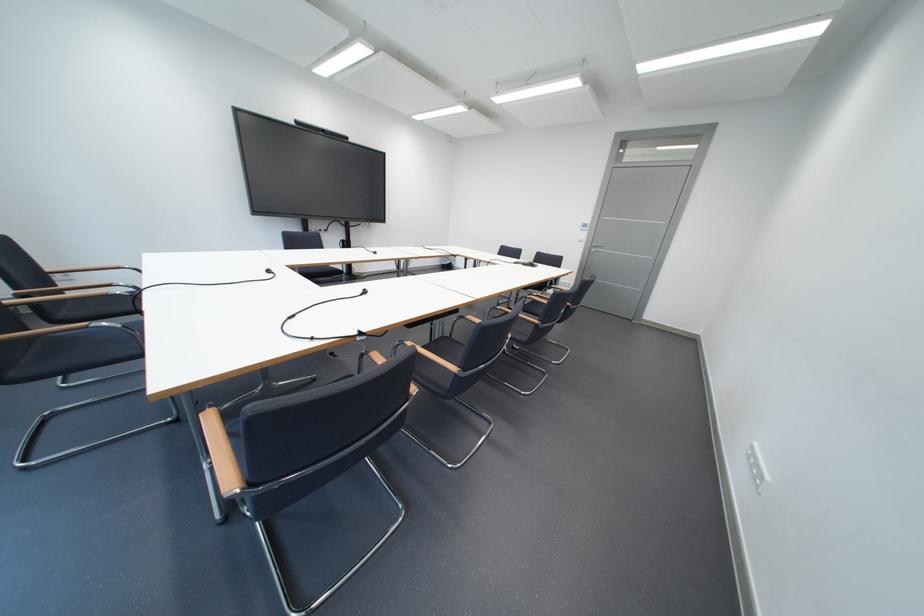
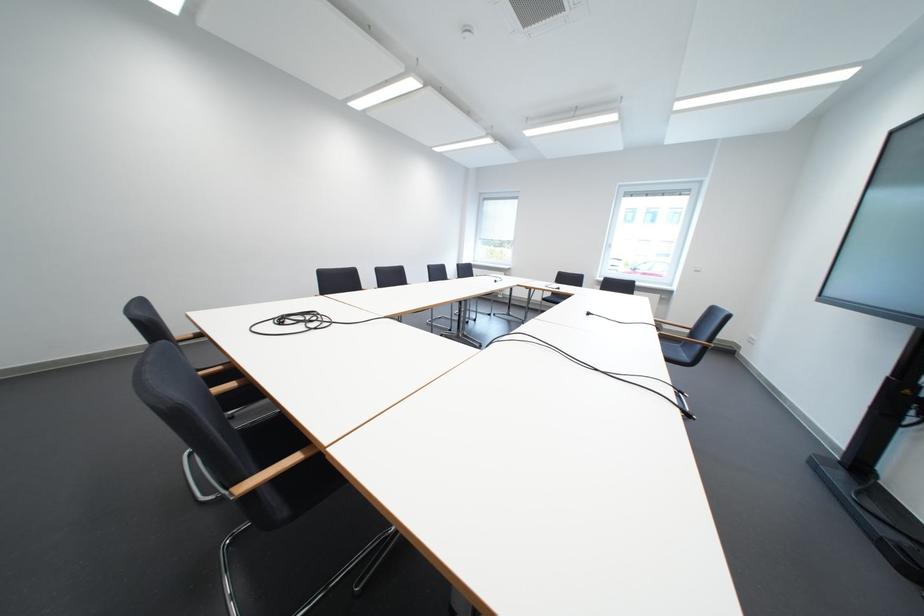
Question: I am providing you with two images of the same scene from different viewpoints. Which of the following objects are not visible in image2?

Choices:
 (A) black electrical plug
 (B) wooden chair armrest
 (C) black chair sitting surface
 (D) small brown bottle

Answer: (C)